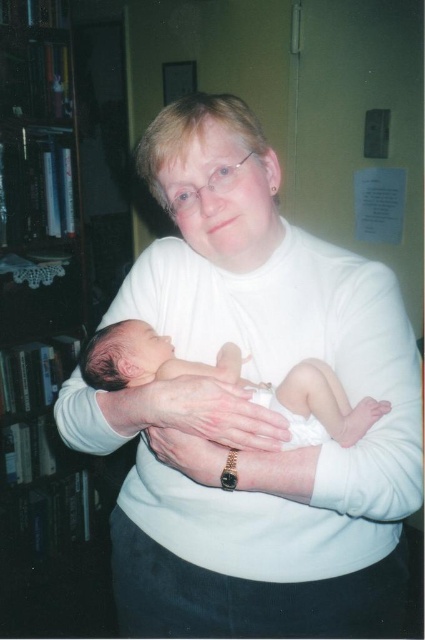
Which is below, white smooth sweater at center or smooth white newborn at center?

white smooth sweater at center

Can you confirm if white smooth sweater at center is thinner than smooth white newborn at center?

No, white smooth sweater at center is not thinner than smooth white newborn at center.

Find the location of a particular element. This screenshot has height=640, width=425. white smooth sweater at center is located at coordinates (252, 408).

Who is more forward, (17, 467) or (132, 340)?

Positioned in front is point (132, 340).

Does black wood bookshelf at left appear on the right side of smooth white newborn at center?

In fact, black wood bookshelf at left is to the left of smooth white newborn at center.

This screenshot has width=425, height=640. What do you see at coordinates (36, 224) in the screenshot? I see `black wood bookshelf at left` at bounding box center [36, 224].

Where is `black wood bookshelf at left`? The width and height of the screenshot is (425, 640). black wood bookshelf at left is located at coordinates (36, 224).

Which of these two, white smooth sweater at center or black wood bookshelf at left, stands shorter?

Standing shorter between the two is white smooth sweater at center.

Does point (158, 134) come in front of point (2, 212)?

That is True.

Is point (393, 560) in front of point (65, 276)?

Yes, point (393, 560) is in front of point (65, 276).

The height and width of the screenshot is (640, 425). Identify the location of white smooth sweater at center. (252, 408).